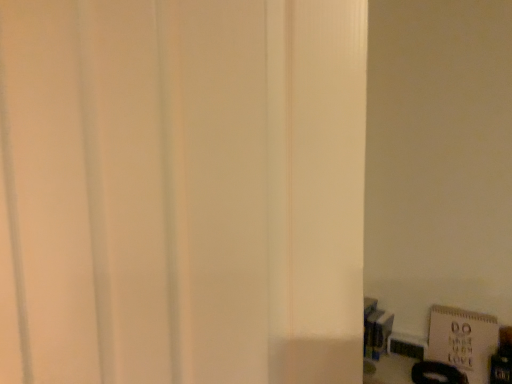
Question: Looking at the image, does white matte door at center seem bigger or smaller compared to white matte bulletin board at lower right?

Choices:
 (A) small
 (B) big

Answer: (B)

Question: Relative to white matte bulletin board at lower right, is white matte door at center in front or behind?

Choices:
 (A) behind
 (B) front

Answer: (B)

Question: Is white matte door at center inside the boundaries of white matte bulletin board at lower right, or outside?

Choices:
 (A) inside
 (B) outside

Answer: (B)

Question: Visually, is white matte bulletin board at lower right positioned to the left or to the right of white matte door at center?

Choices:
 (A) left
 (B) right

Answer: (B)

Question: Is white matte bulletin board at lower right wider or thinner than white matte door at center?

Choices:
 (A) thin
 (B) wide

Answer: (A)

Question: Does point (497, 339) appear closer or farther from the camera than point (292, 62)?

Choices:
 (A) farther
 (B) closer

Answer: (A)

Question: In terms of size, does white matte bulletin board at lower right appear bigger or smaller than white matte door at center?

Choices:
 (A) small
 (B) big

Answer: (A)